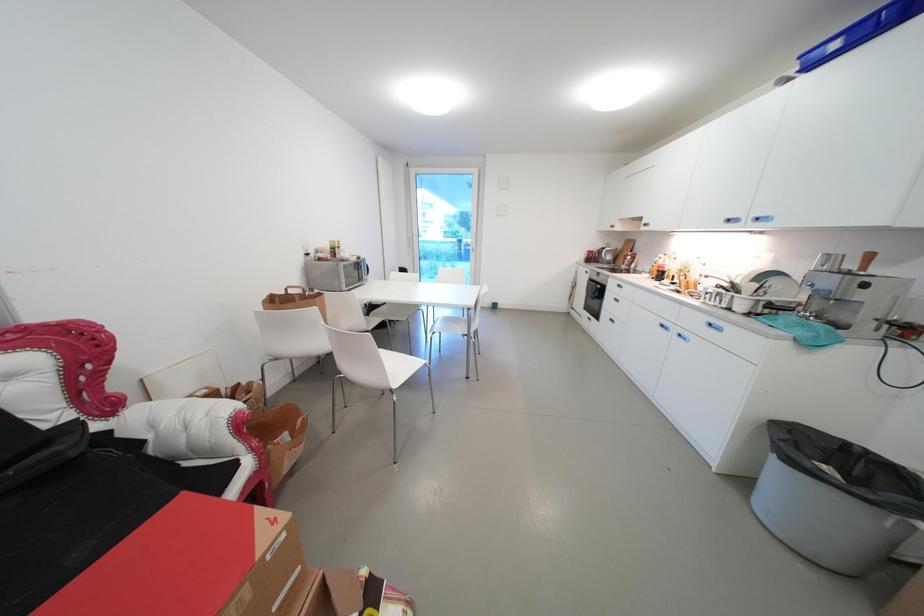
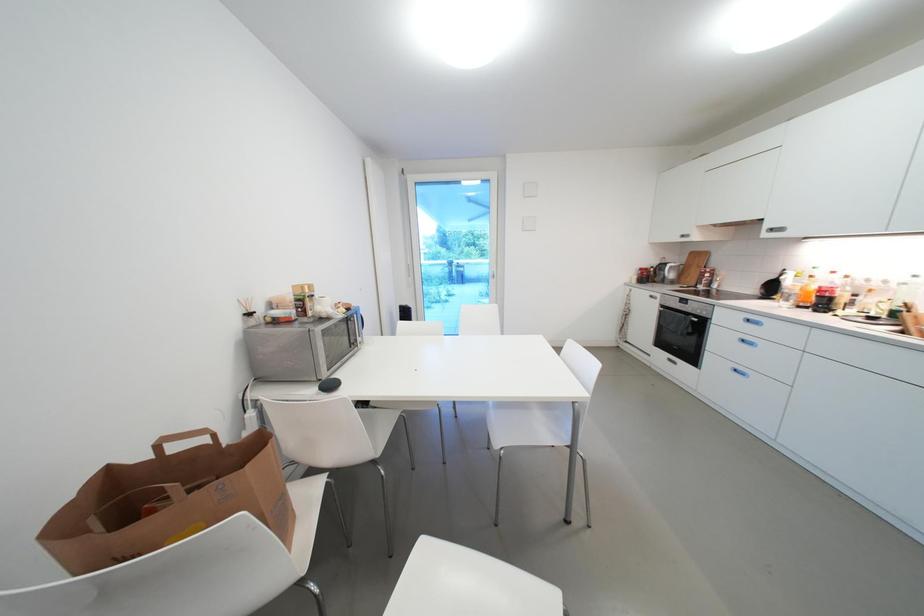
Which direction would the cameraman need to move to produce the second image?

The movement direction of the cameraman is left, forward.